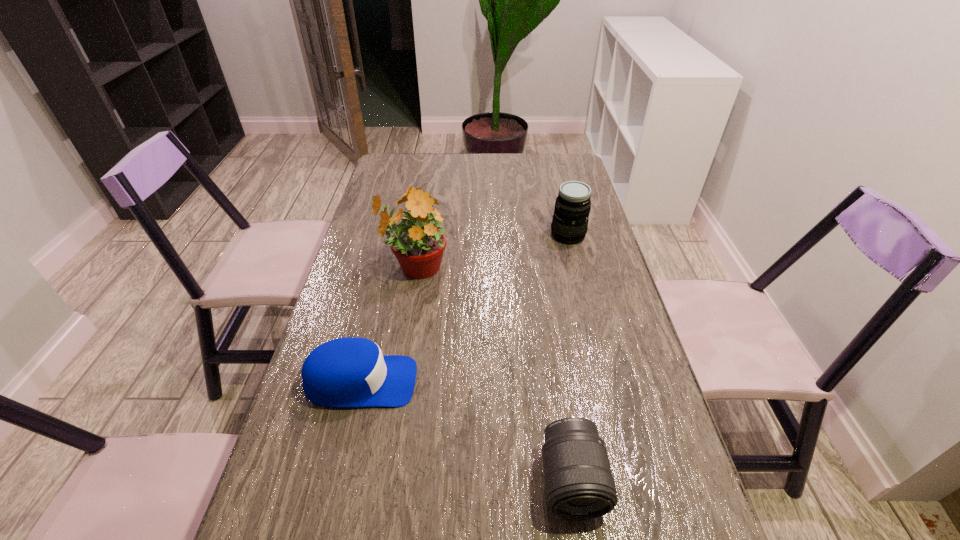
Where is `free area in between the nearest object and the tallest object`? free area in between the nearest object and the tallest object is located at coordinates [493, 375].

Image resolution: width=960 pixels, height=540 pixels. What are the coordinates of `vacant area between the shortest object and the nearest object` in the screenshot? It's located at (467, 431).

Find the location of a particular element. The height and width of the screenshot is (540, 960). free space between the shorter telephoto lens and the flowerpot is located at coordinates (493, 375).

Find the location of `empty space that is in between the second nearest object and the taller telephoto lens`. empty space that is in between the second nearest object and the taller telephoto lens is located at coordinates (465, 308).

This screenshot has width=960, height=540. Find the location of `free spot between the third farthest object and the flowerpot`. free spot between the third farthest object and the flowerpot is located at coordinates (388, 326).

This screenshot has width=960, height=540. In order to click on vacant space in between the tallest object and the shorter telephoto lens in this screenshot , I will do `click(493, 375)`.

Where is `the second closest object to the baseball cap`? the second closest object to the baseball cap is located at coordinates (579, 485).

Locate which object is the closest to the flowerpot. Please provide its 2D coordinates. Your answer should be formatted as a tuple, i.e. [(x, y)], where the tuple contains the x and y coordinates of a point satisfying the conditions above.

[(346, 372)]

Find the location of a particular element. vacant space that satisfies the following two spatial constraints: 1. on the back side of the flowerpot; 2. on the left side of the taller telephoto lens is located at coordinates (420, 235).